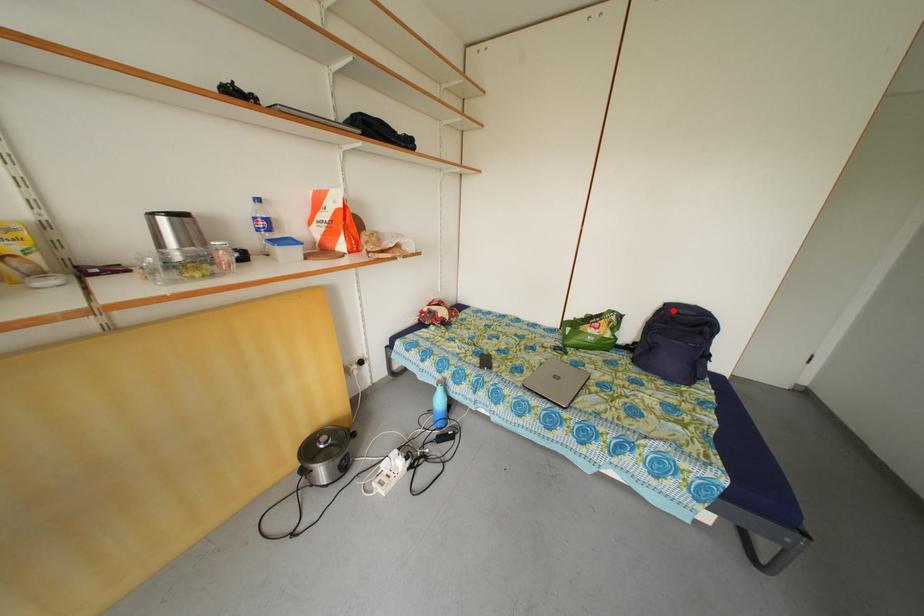
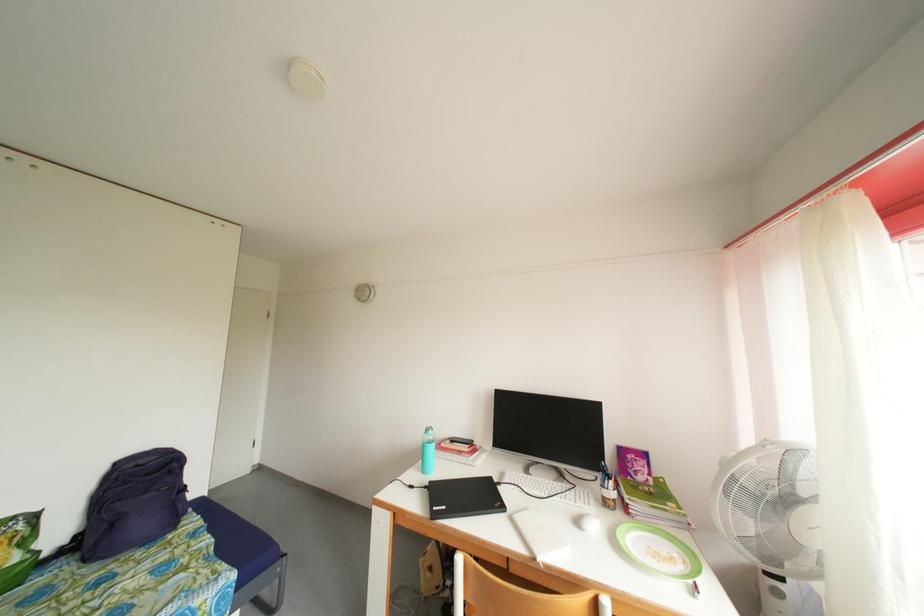
Question: I am providing you with two images of the same scene from different viewpoints. A red point is marked on the first image. Is the red point's position out of view in image 2?

Choices:
 (A) Yes
 (B) No

Answer: (B)